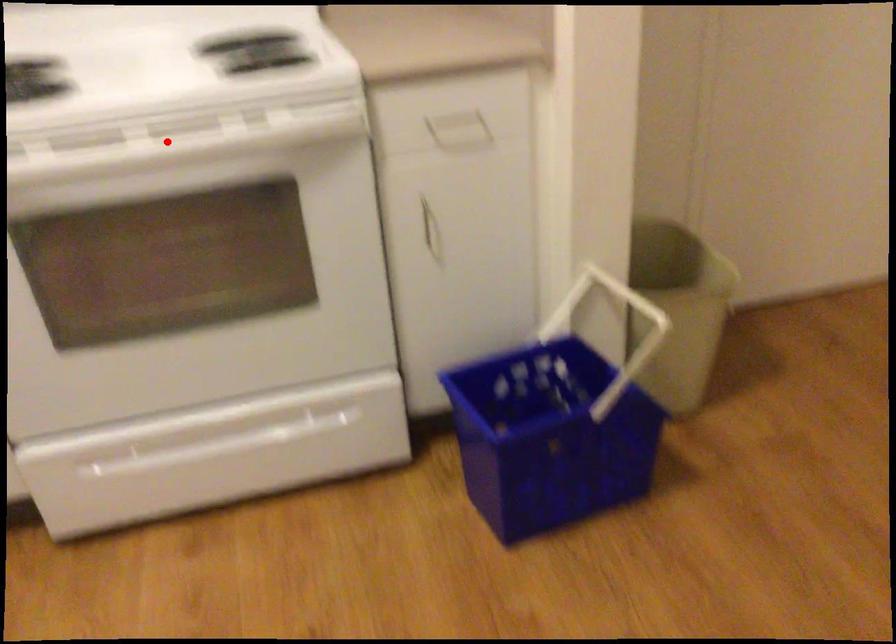
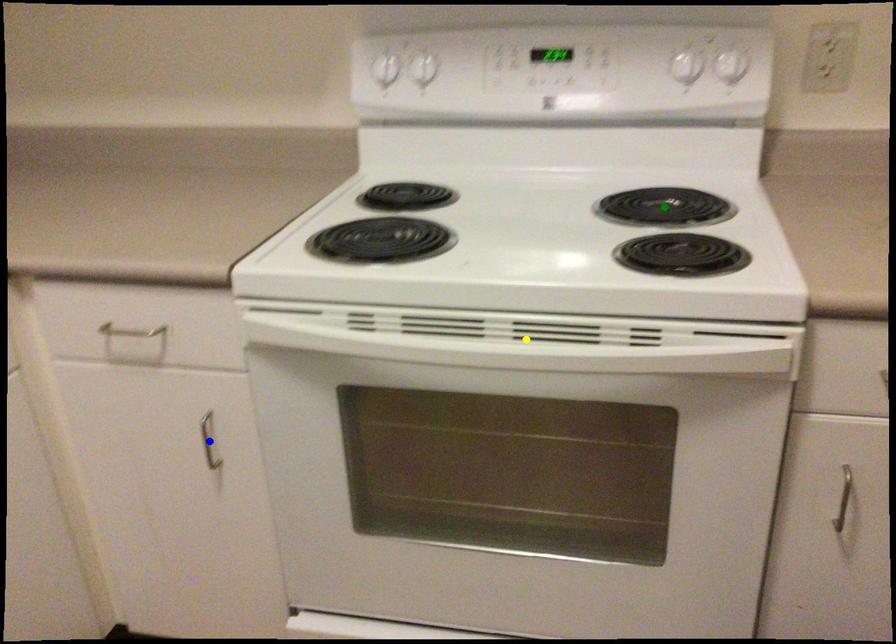
Question: I am providing you with two images of the same scene from different viewpoints. A red point is marked on the first image. You are given multiple points on the second image. Which point in image 2 represents the same 3d spot as the red point in image 1?

Choices:
 (A) blue point
 (B) green point
 (C) yellow point

Answer: (C)